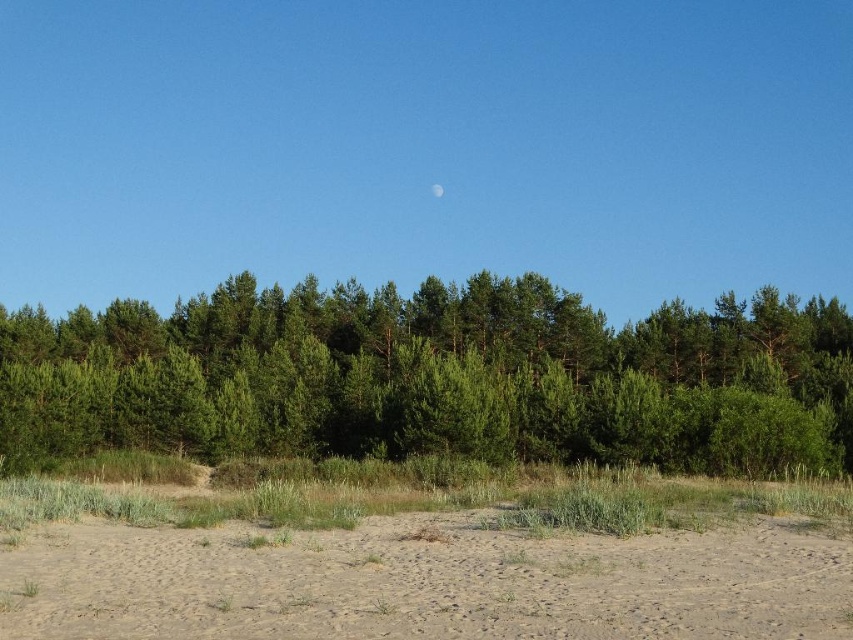
Question: Is brown sandy dirt at lower center closer to the viewer compared to white glossy moon at upper center?

Choices:
 (A) yes
 (B) no

Answer: (A)

Question: Which of the following is the farthest from the observer?

Choices:
 (A) (438, 192)
 (B) (260, 532)
 (C) (90, 396)

Answer: (A)

Question: Which object is positioned farthest from the green leafy forest at center?

Choices:
 (A) brown sandy dirt at lower center
 (B) white glossy moon at upper center

Answer: (B)

Question: Among these points, which one is farthest from the camera?

Choices:
 (A) (436, 195)
 (B) (527, 609)
 (C) (405, 372)

Answer: (A)

Question: Can you confirm if green leafy forest at center is smaller than white glossy moon at upper center?

Choices:
 (A) no
 (B) yes

Answer: (A)

Question: Is green leafy forest at center further to camera compared to white glossy moon at upper center?

Choices:
 (A) no
 (B) yes

Answer: (A)